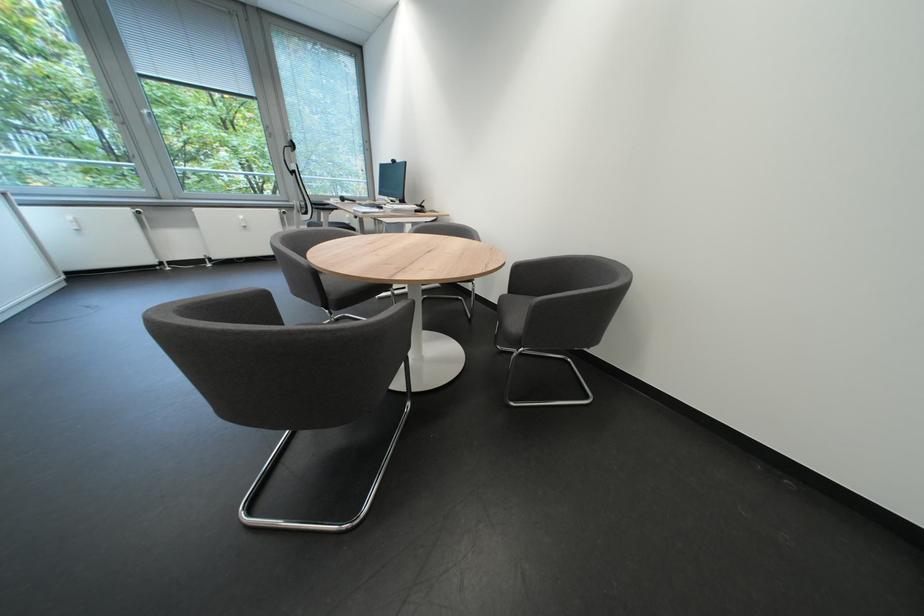
Describe the element at coordinates (241, 222) in the screenshot. I see `a white radiator knob` at that location.